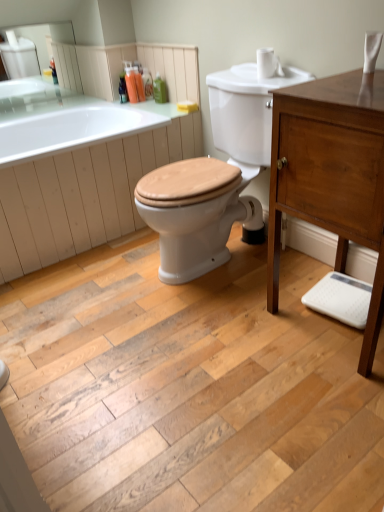
Describe the element at coordinates (147, 83) in the screenshot. I see `translucent plastic soap dispenser at upper center, positioned as the third toiletry in left-to-right order` at that location.

I want to click on matte brown cabinet at right, so click(x=331, y=175).

What do you see at coordinates (131, 83) in the screenshot?
I see `translucent plastic soap dispenser at upper center, which is the 1th toiletry in left-to-right order` at bounding box center [131, 83].

What do you see at coordinates (228, 163) in the screenshot? The height and width of the screenshot is (512, 384). I see `white glossy toilet at center` at bounding box center [228, 163].

What do you see at coordinates (72, 170) in the screenshot? The width and height of the screenshot is (384, 512). I see `white glossy bathtub at upper left` at bounding box center [72, 170].

Where is `translucent plastic bottles at upper center, acting as the second toiletry starting from the left`? translucent plastic bottles at upper center, acting as the second toiletry starting from the left is located at coordinates point(139,84).

Does translucent plastic soap dispenser at upper center, which is the 1th toiletry in left-to-right order, have a lesser height compared to white glossy toilet at center?

Yes, translucent plastic soap dispenser at upper center, which is the 1th toiletry in left-to-right order, is shorter than white glossy toilet at center.

Based on the photo, which is nearer, (129,80) or (245,101)?

Answer: Point (129,80) appears to be farther away from the viewer than point (245,101).

Consider the image. Between translucent plastic soap dispenser at upper center, which is the 1th toiletry in left-to-right order, and white glossy toilet at center, which one appears on the right side from the viewer's perspective?

white glossy toilet at center.

Which toiletry is the 3rd one when counting from the back of the white glossy toilet at center? Please provide its 2D coordinates.

[(131, 83)]

Are white glossy bathtub at upper left and white glossy toilet at center far apart?

No, white glossy bathtub at upper left is not far from white glossy toilet at center.

Does point (62, 110) come closer to viewer compared to point (255, 204)?

No, it is not.

Would you say white glossy bathtub at upper left is outside white glossy toilet at center?

white glossy bathtub at upper left lies outside white glossy toilet at center's area.

Which object is positioned more to the left, translucent plastic soap dispenser at upper center, placed as the fourth toiletry when sorted from right to left, or white matte toilet paper at upper right?

translucent plastic soap dispenser at upper center, placed as the fourth toiletry when sorted from right to left, is more to the left.

Who is smaller, translucent plastic soap dispenser at upper center, placed as the fourth toiletry when sorted from right to left, or white matte toilet paper at upper right?

translucent plastic soap dispenser at upper center, placed as the fourth toiletry when sorted from right to left, is smaller.

Is translucent plastic soap dispenser at upper center, placed as the fourth toiletry when sorted from right to left, located outside white matte toilet paper at upper right?

Absolutely, translucent plastic soap dispenser at upper center, placed as the fourth toiletry when sorted from right to left, is external to white matte toilet paper at upper right.

From the image's perspective, would you say translucent plastic soap dispenser at upper center, which is the 1th toiletry in left-to-right order, is shown under white matte toilet paper at upper right?

Actually, translucent plastic soap dispenser at upper center, which is the 1th toiletry in left-to-right order, appears above white matte toilet paper at upper right in the image.

Is point (344, 122) less distant than point (271, 55)?

Yes.

Between matte brown cabinet at right and white matte toilet paper at upper right, which one has more height?

matte brown cabinet at right is taller.

Which object is closer to the camera taking this photo, matte brown cabinet at right or white matte toilet paper at upper right?

matte brown cabinet at right is closer to the camera.

Is matte brown cabinet at right at the left side of white matte toilet paper at upper right?

No.

Consider the image. Between white glossy toilet at center and green plastic bottle at upper center, placed as the 1th toiletry when sorted from right to left, which one appears on the left side from the viewer's perspective?

From the viewer's perspective, green plastic bottle at upper center, placed as the 1th toiletry when sorted from right to left, appears more on the left side.

Can we say white glossy toilet at center lies outside green plastic bottle at upper center, placed as the 1th toiletry when sorted from right to left?

Yes.

Between white glossy toilet at center and green plastic bottle at upper center, placed as the 1th toiletry when sorted from right to left, which one has larger width?

white glossy toilet at center is wider.

Is point (156, 220) closer to camera compared to point (165, 87)?

Yes, it is in front of point (165, 87).

Could you tell me if translucent plastic soap dispenser at upper center, positioned as the third toiletry in left-to-right order, is turned towards white glossy bathtub at upper left?

Yes.

Considering the relative sizes of translucent plastic soap dispenser at upper center, positioned as the third toiletry in left-to-right order, and white glossy bathtub at upper left in the image provided, is translucent plastic soap dispenser at upper center, positioned as the third toiletry in left-to-right order, taller than white glossy bathtub at upper left?

No, translucent plastic soap dispenser at upper center, positioned as the third toiletry in left-to-right order, is not taller than white glossy bathtub at upper left.

Between translucent plastic soap dispenser at upper center, the 2th toiletry when ordered from right to left, and white glossy bathtub at upper left, which one appears on the right side from the viewer's perspective?

Positioned to the right is translucent plastic soap dispenser at upper center, the 2th toiletry when ordered from right to left.

Is the surface of white glossy bathtub at upper left in direct contact with white matte toilet paper at upper right?

No, white glossy bathtub at upper left is not next to white matte toilet paper at upper right.

From the picture: Between white glossy bathtub at upper left and white matte toilet paper at upper right, which one has smaller size?

white matte toilet paper at upper right is smaller.

Could you tell me if white glossy bathtub at upper left is turned towards white matte toilet paper at upper right?

No, white glossy bathtub at upper left is not facing towards white matte toilet paper at upper right.

This screenshot has height=512, width=384. Find the location of `the 4th toiletry directly above the white glossy toilet at center (from a real-world perspective)`. the 4th toiletry directly above the white glossy toilet at center (from a real-world perspective) is located at coordinates (131, 83).

Find the location of a particular element. The height and width of the screenshot is (512, 384). porcelain that appears below the white glossy bathtub at upper left (from the image's perspective) is located at coordinates (228, 163).

Considering their positions, is translucent plastic soap dispenser at upper center, which is the 1th toiletry in left-to-right order, positioned closer to white glossy bathtub at upper left than matte brown cabinet at right?

translucent plastic soap dispenser at upper center, which is the 1th toiletry in left-to-right order, is closer to white glossy bathtub at upper left.

Based on their spatial positions, is translucent plastic bottles at upper center, positioned as the 3th toiletry in right-to-left order, or white glossy bathtub at upper left closer to translucent plastic soap dispenser at upper center, which is the 1th toiletry in left-to-right order?

translucent plastic bottles at upper center, positioned as the 3th toiletry in right-to-left order, is positioned closer to the anchor translucent plastic soap dispenser at upper center, which is the 1th toiletry in left-to-right order.

Estimate the real-world distances between objects in this image. Which object is further from white glossy bathtub at upper left, translucent plastic soap dispenser at upper center, positioned as the third toiletry in left-to-right order, or green plastic bottle at upper center, the 4th toiletry viewed from the left?

The object further to white glossy bathtub at upper left is translucent plastic soap dispenser at upper center, positioned as the third toiletry in left-to-right order.

Based on their spatial positions, is matte brown cabinet at right or white matte toilet paper at upper right further from green plastic bottle at upper center, the 4th toiletry viewed from the left?

matte brown cabinet at right lies further to green plastic bottle at upper center, the 4th toiletry viewed from the left, than the other object.

Estimate the real-world distances between objects in this image. Which object is further from white glossy bathtub at upper left, translucent plastic soap dispenser at upper center, positioned as the third toiletry in left-to-right order, or white matte toilet paper at upper right?

white matte toilet paper at upper right lies further to white glossy bathtub at upper left than the other object.

From the image, which object appears to be farther from translucent plastic soap dispenser at upper center, the 2th toiletry when ordered from right to left, white matte toilet paper at upper right or green plastic bottle at upper center, the 4th toiletry viewed from the left?

Based on the image, white matte toilet paper at upper right appears to be further to translucent plastic soap dispenser at upper center, the 2th toiletry when ordered from right to left.

Which object lies nearer to the anchor point matte brown cabinet at right, white glossy toilet at center or white matte toilet paper at upper right?

white glossy toilet at center is closer to matte brown cabinet at right.

Based on their spatial positions, is green plastic bottle at upper center, the 4th toiletry viewed from the left, or translucent plastic soap dispenser at upper center, positioned as the third toiletry in left-to-right order, closer to white glossy bathtub at upper left?

green plastic bottle at upper center, the 4th toiletry viewed from the left.

Identify the location of bath between matte brown cabinet at right and green plastic bottle at upper center, placed as the 1th toiletry when sorted from right to left, along the z-axis. (72, 170).

Locate an element on the screen. bath between white glossy toilet at center and green plastic bottle at upper center, placed as the 1th toiletry when sorted from right to left, along the z-axis is located at coordinates (72, 170).

What are the coordinates of `porcelain positioned between matte brown cabinet at right and green plastic bottle at upper center, placed as the 1th toiletry when sorted from right to left, from near to far` in the screenshot? It's located at (228, 163).

I want to click on toilet paper between white glossy toilet at center and translucent plastic soap dispenser at upper center, positioned as the third toiletry in left-to-right order, along the z-axis, so click(266, 63).